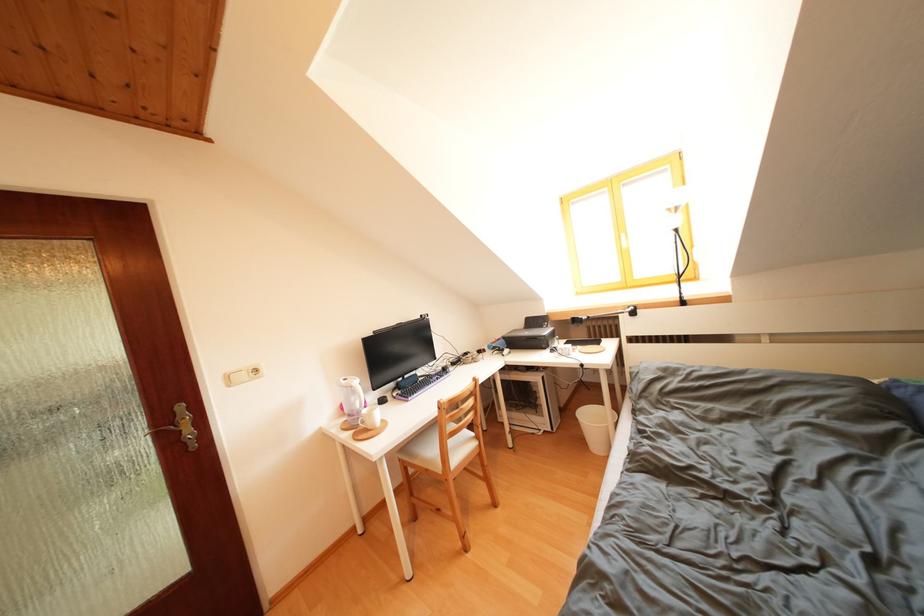
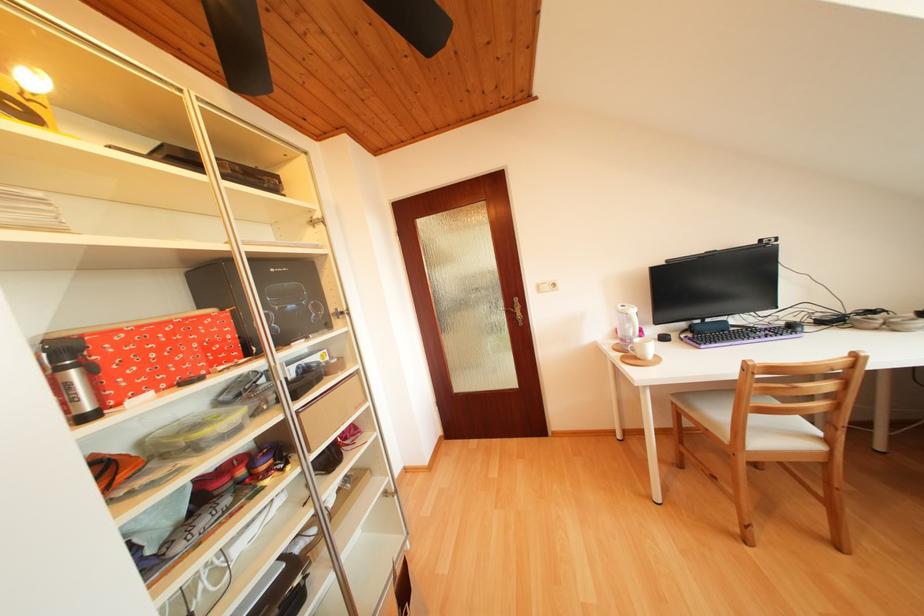
Find the pixel in the second image that matches [360,403] in the first image.

(636, 331)